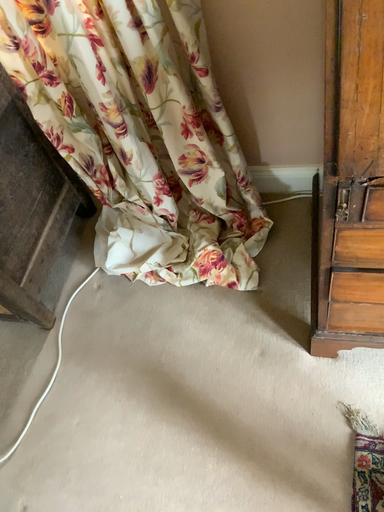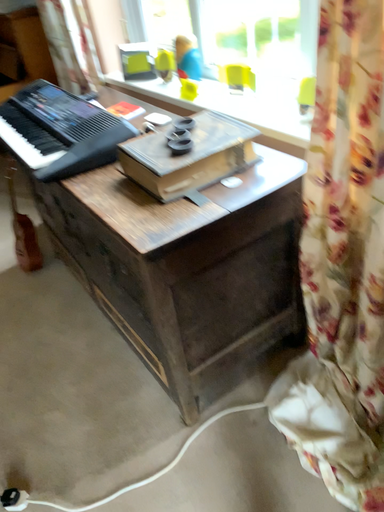
Question: How did the camera likely rotate when shooting the video?

Choices:
 (A) rotated upward
 (B) rotated downward

Answer: (A)